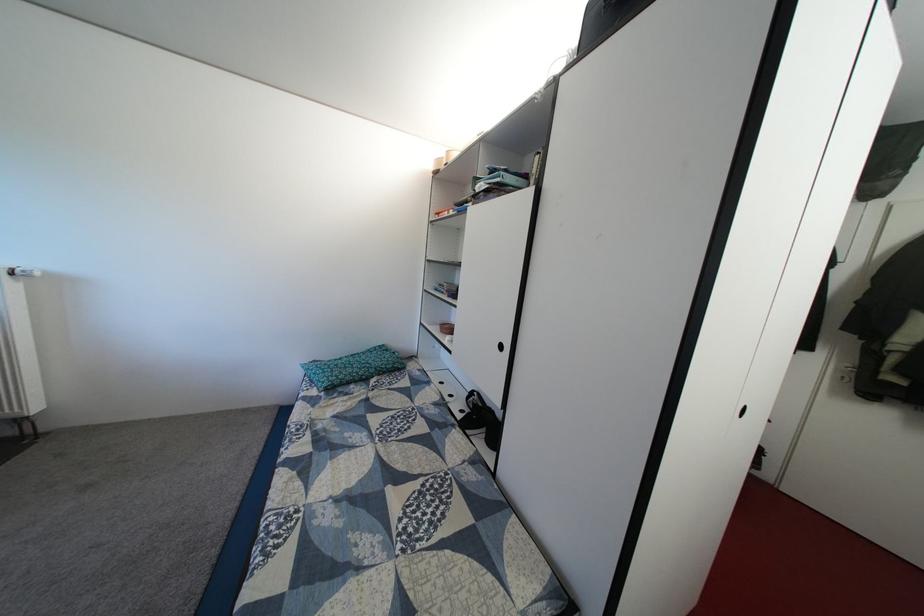
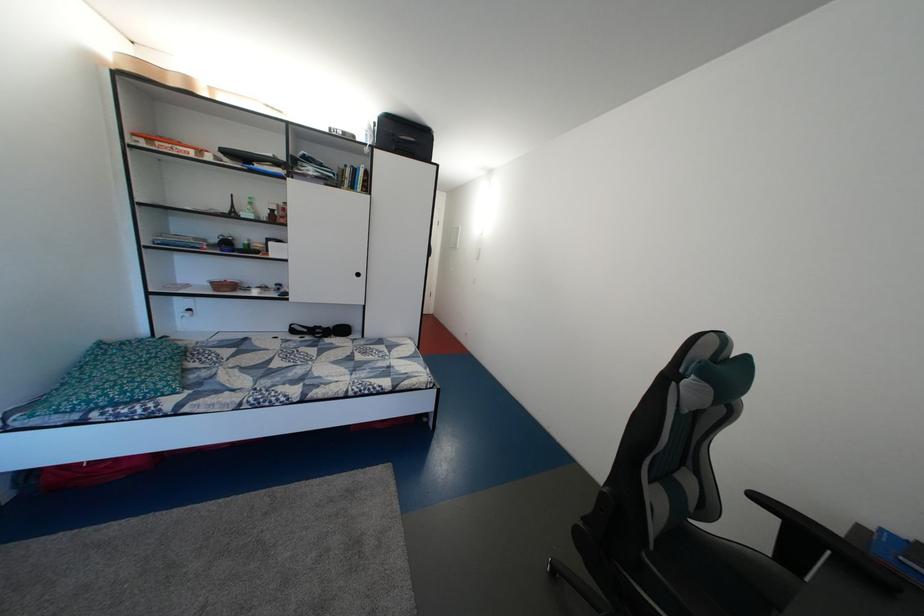
In the second image, find the point that corresponds to (x=357, y=374) in the first image.

(160, 376)